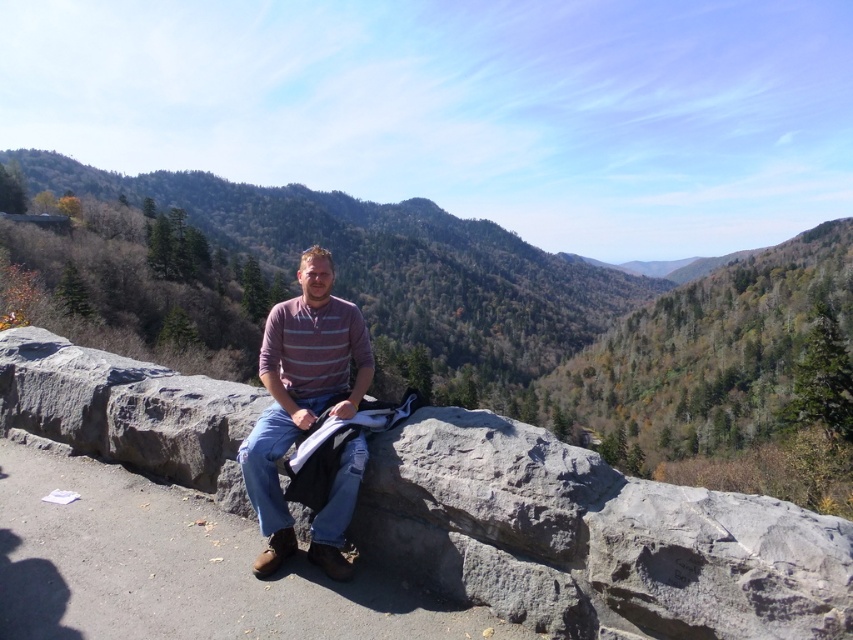
You are a hiker who has just reached the viewpoint. You notice the gray rough stone at center and the striped cotton shirt at center. Which object is positioned to the right side of the other?

The gray rough stone at center is to the right of the striped cotton shirt at center.

You are a hiker who wants to place a 2.5 meter long tent between the gray rough stone at center and the striped cotton shirt at center. Is there enough space between them to fit the tent?

The gray rough stone at center and striped cotton shirt at center are 3.60 meters apart from each other. Since the tent is 2.5 meters long, there is enough space between them to fit the tent as the distance is greater than the tent length.

You are an outdoor photographer planning to capture the scene with the gray rough stone at center and the striped cotton shirt at center. Which object should you focus on if you want to highlight the larger subject in your composition?

The striped cotton shirt at center should be the focus because it occupies more space than the gray rough stone at center, making it the larger subject in the scene.